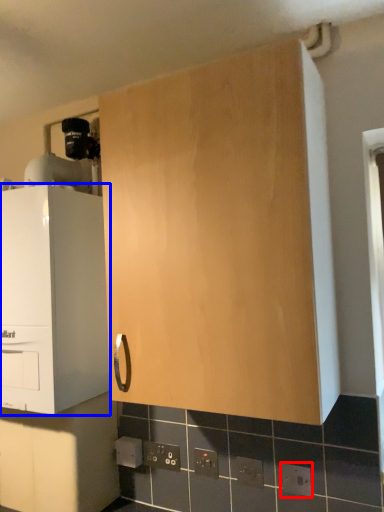
Question: Which object is further to the camera taking this photo, electric outlet (highlighted by a red box) or cabinetry (highlighted by a blue box)?

Choices:
 (A) electric outlet
 (B) cabinetry

Answer: (B)